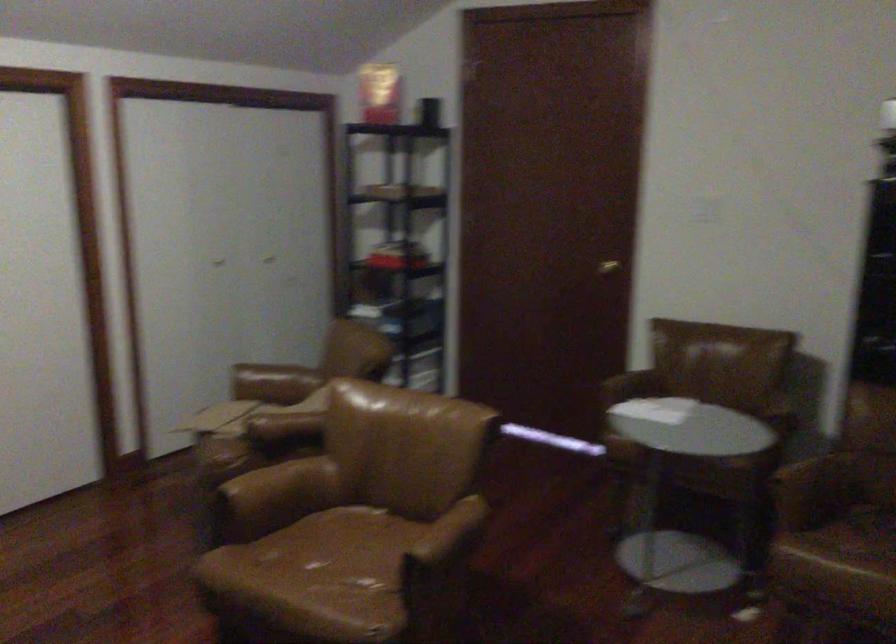
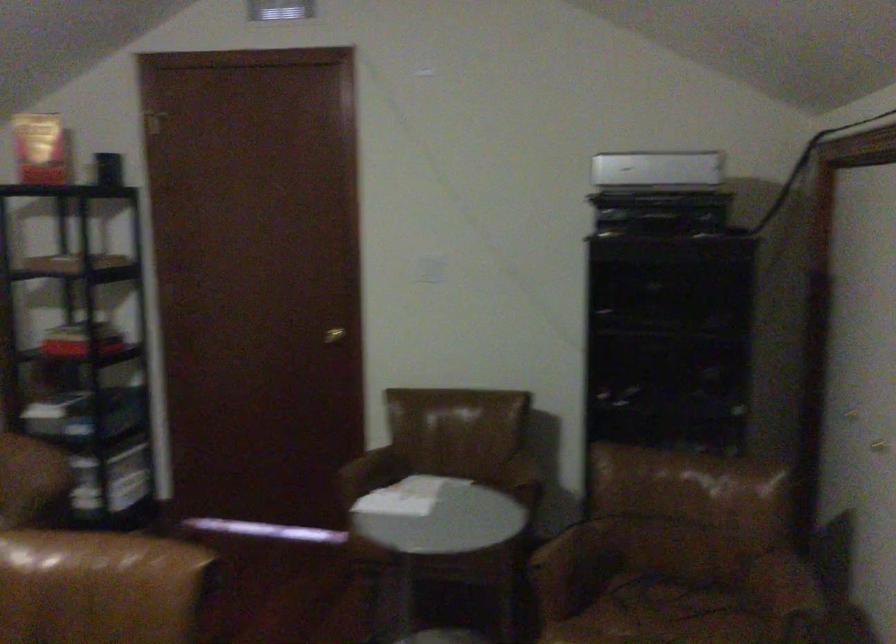
Question: The images are taken continuously from a first-person perspective. In which direction are you moving?

Choices:
 (A) Left
 (B) Right
 (C) Forward
 (D) Backward

Answer: (C)